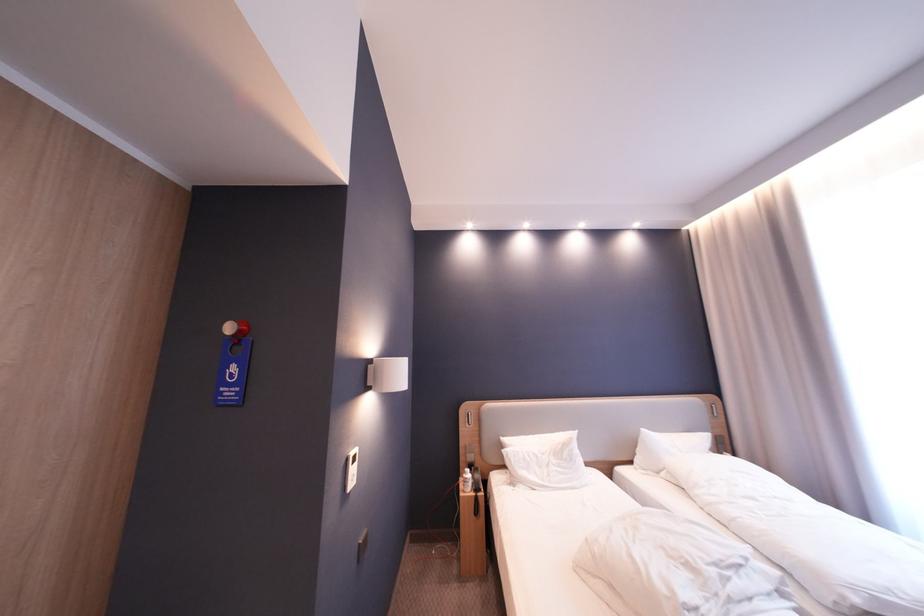
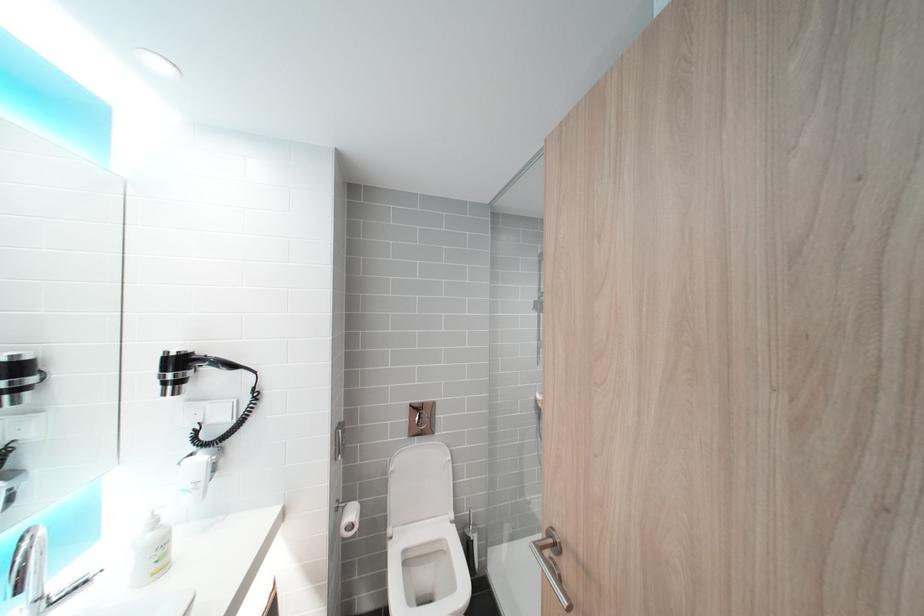
Question: The images are taken continuously from a first-person perspective. In which direction are you moving?

Choices:
 (A) Left
 (B) Right
 (C) Forward
 (D) Backward

Answer: (A)